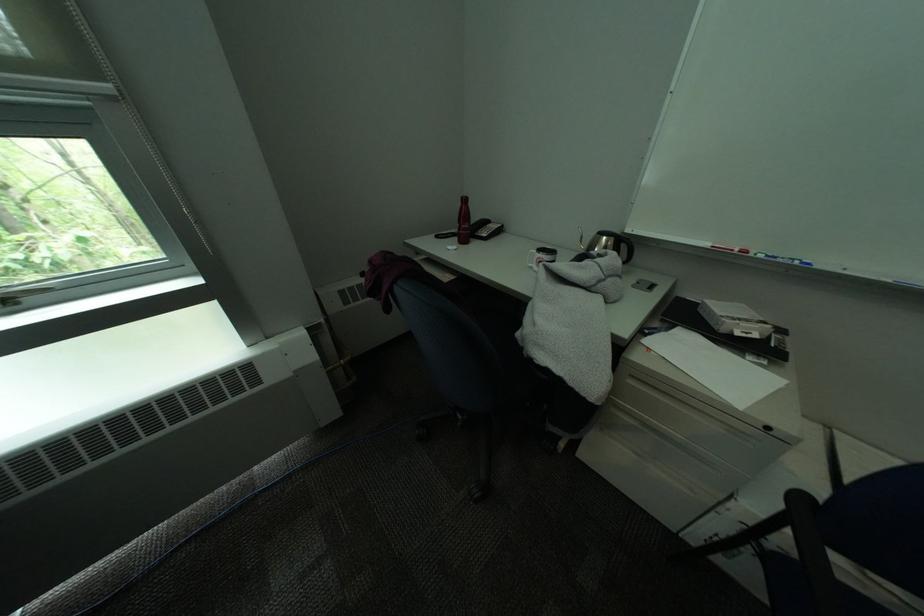
This screenshot has height=616, width=924. Describe the element at coordinates (132, 115) in the screenshot. I see `a blind pull chain` at that location.